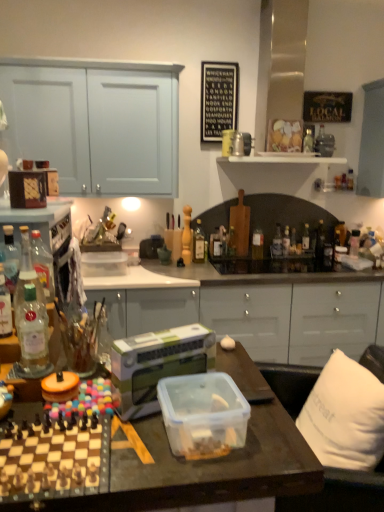
Where is `vacant region in front of translucent glass bottle at center, which is the tenth bottle in right-to-left order`? This screenshot has width=384, height=512. vacant region in front of translucent glass bottle at center, which is the tenth bottle in right-to-left order is located at coordinates (186, 271).